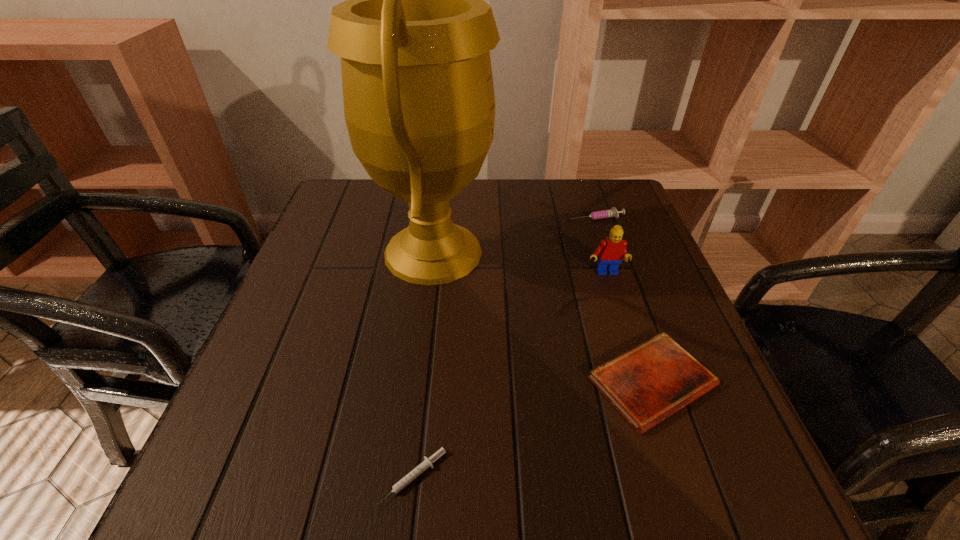
The height and width of the screenshot is (540, 960). What are the coordinates of `vacant space located on the left of the diary` in the screenshot? It's located at (537, 382).

Identify the location of vacant space positioned on the right of the shortest object. (500, 478).

Identify the location of trophy that is at the far edge. (414, 35).

Where is `syringe situated at the far edge`? This screenshot has height=540, width=960. syringe situated at the far edge is located at coordinates (613, 212).

Where is `object that is at the near edge`? Image resolution: width=960 pixels, height=540 pixels. object that is at the near edge is located at coordinates (x=428, y=462).

This screenshot has height=540, width=960. Identify the location of object at the left edge. (414, 35).

At what (x,y) coordinates should I click in order to perform the action: click on Lego at the right edge. Please return your answer as a coordinate pair (x, y). The height and width of the screenshot is (540, 960). Looking at the image, I should click on (612, 250).

I want to click on syringe that is at the right edge, so click(613, 212).

Locate an element on the screen. diary located at the right edge is located at coordinates (648, 383).

The height and width of the screenshot is (540, 960). What are the coordinates of `object that is at the far left corner` in the screenshot? It's located at (414, 35).